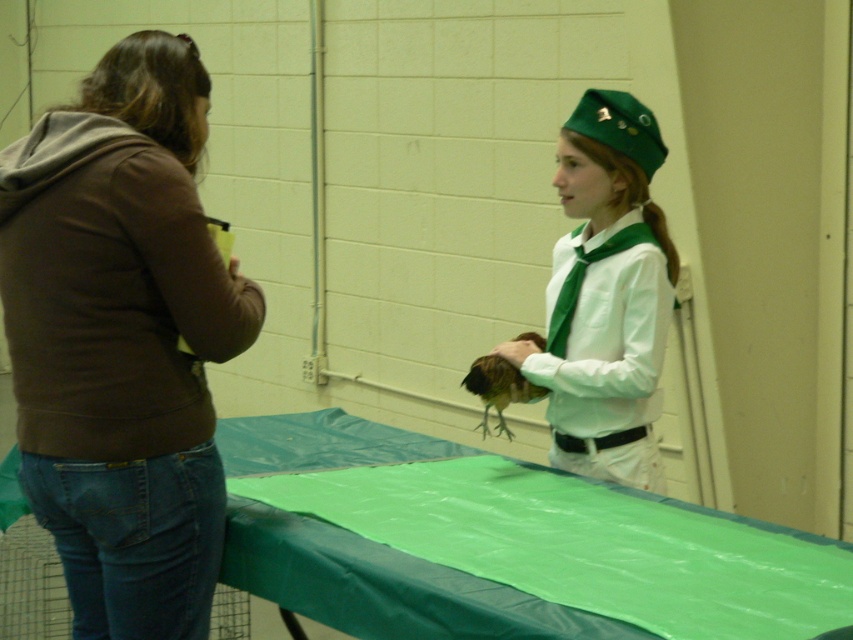
You are a photographer standing in front of the scene. You want to take a photo that includes both the brown cotton hoodie at left and the green matte uniform at center. Which object should you focus on first to ensure both are in frame?

The brown cotton hoodie at left is positioned under the green matte uniform at center, so you should focus on the green matte uniform at center first to ensure both are in frame.

You are a photographer standing at the center of the room. You want to take a photo of the brown cotton hoodie at left. What is the coordinate of the hoodie to frame it properly?

The coordinate of the brown cotton hoodie at left is at point (122, 339).

You are a photographer setting up for a group photo. You need to ensure that the brown cotton hoodie at left and the green matte uniform at center are both visible in the frame. Based on their positions, which one is closer to the camera?

The brown cotton hoodie at left is closer to the camera since it is in front of the green matte uniform at center.